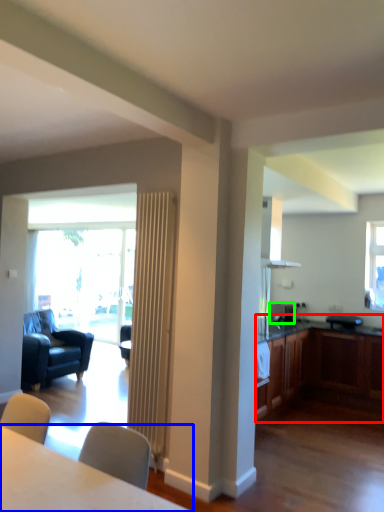
Question: Which is farther away from cabinetry (highlighted by a red box)? table (highlighted by a blue box) or appliance (highlighted by a green box)?

Choices:
 (A) table
 (B) appliance

Answer: (A)